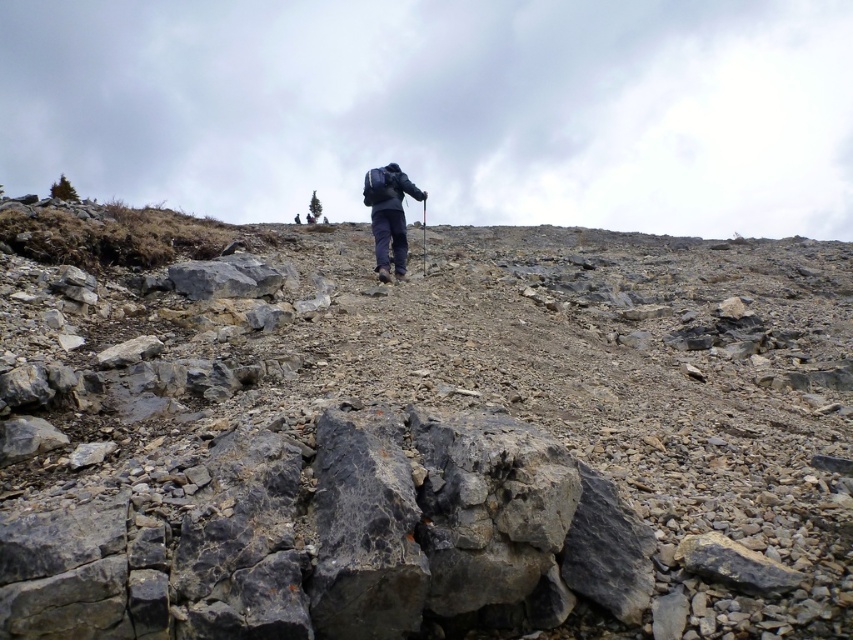
You are a hiker trying to navigate the rocky terrain. You notice the gray rocky hillside at center and the dark blue fabric backpack at center. Which object is closer to you?

The gray rocky hillside at center is closer to the viewer than the dark blue fabric backpack at center.

You are a hiker trying to navigate the rocky terrain. You notice the gray rocky hillside at center and the dark blue fabric backpack at center. Which object is positioned to the right of the other?

The gray rocky hillside at center is to the right of the dark blue fabric backpack at center.

You are a hiker trying to navigate the rocky terrain. You notice the gray rocky hillside at center and the dark blue fabric backpack at center. Which object is positioned lower in the image?

The gray rocky hillside at center is positioned below the dark blue fabric backpack at center, so it is lower in the image.